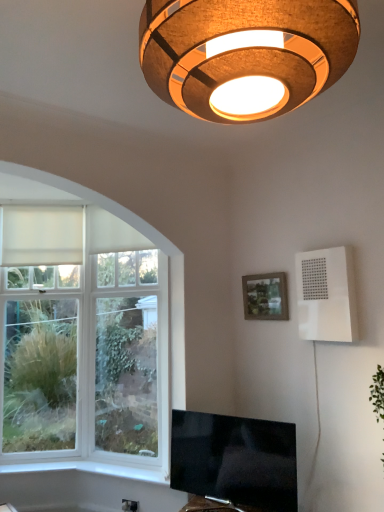
Question: Would you consider flat-screen tv at lower center to be distant from matte wooden picture frame at upper right?

Choices:
 (A) yes
 (B) no

Answer: (A)

Question: Can we say flat-screen tv at lower center lies outside matte wooden picture frame at upper right?

Choices:
 (A) no
 (B) yes

Answer: (B)

Question: Is flat-screen tv at lower center wider than matte wooden picture frame at upper right?

Choices:
 (A) no
 (B) yes

Answer: (B)

Question: Would you say matte wooden picture frame at upper right is part of flat-screen tv at lower center's contents?

Choices:
 (A) yes
 (B) no

Answer: (B)

Question: Is flat-screen tv at lower center directly adjacent to matte wooden picture frame at upper right?

Choices:
 (A) no
 (B) yes

Answer: (A)

Question: Is flat-screen tv at lower center bigger or smaller than white plastic electric outlet at lower center?

Choices:
 (A) small
 (B) big

Answer: (B)

Question: Is point (294, 465) positioned closer to the camera than point (122, 506)?

Choices:
 (A) closer
 (B) farther

Answer: (A)

Question: Is flat-screen tv at lower center in front of or behind white plastic electric outlet at lower center in the image?

Choices:
 (A) behind
 (B) front

Answer: (B)

Question: Considering the positions of flat-screen tv at lower center and white plastic electric outlet at lower center in the image, is flat-screen tv at lower center taller or shorter than white plastic electric outlet at lower center?

Choices:
 (A) short
 (B) tall

Answer: (B)

Question: Looking at the image, does white plastic speaker at upper right seem bigger or smaller compared to white matte curtain at left?

Choices:
 (A) big
 (B) small

Answer: (A)

Question: Considering the positions of white plastic speaker at upper right and white matte curtain at left in the image, is white plastic speaker at upper right wider or thinner than white matte curtain at left?

Choices:
 (A) wide
 (B) thin

Answer: (A)

Question: Considering their positions, is white plastic speaker at upper right located in front of or behind white matte curtain at left?

Choices:
 (A) behind
 (B) front

Answer: (B)

Question: From the image's perspective, is white plastic speaker at upper right positioned above or below white matte curtain at left?

Choices:
 (A) below
 (B) above

Answer: (A)

Question: In terms of height, does matte brown lampshade at upper center look taller or shorter compared to white smooth window sill at lower left?

Choices:
 (A) tall
 (B) short

Answer: (A)

Question: Is matte brown lampshade at upper center situated inside white smooth window sill at lower left or outside?

Choices:
 (A) outside
 (B) inside

Answer: (A)